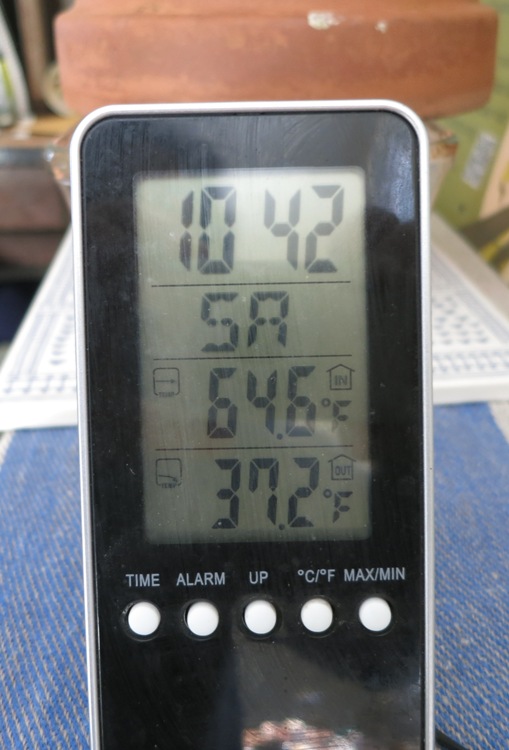
The image size is (509, 750). Find the location of `remote control of some sort`. remote control of some sort is located at coordinates (210, 144).